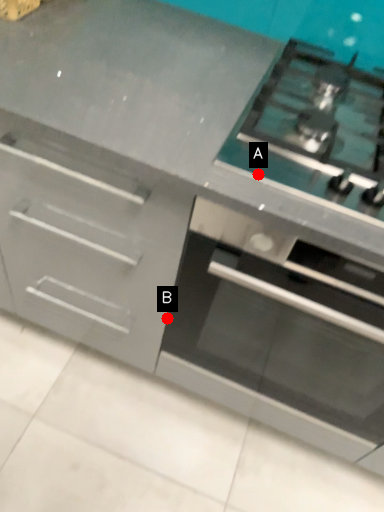
Question: Two points are circled on the image, labeled by A and B beside each circle. Which point is farther from the camera taking this photo?

Choices:
 (A) A is further
 (B) B is further

Answer: (B)